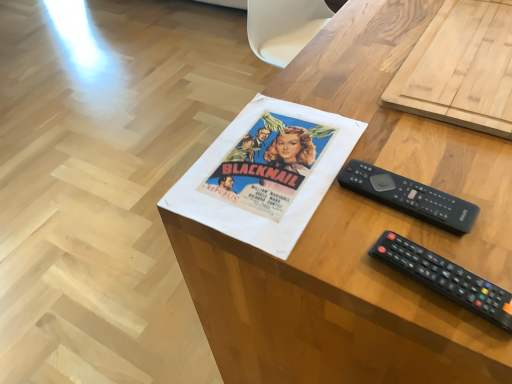
Identify the location of vacant space that's between black plastic remote at lower right, the first remote control positioned from the front, and black plastic remote at center right, the first remote control positioned from the top. The width and height of the screenshot is (512, 384). (400, 238).